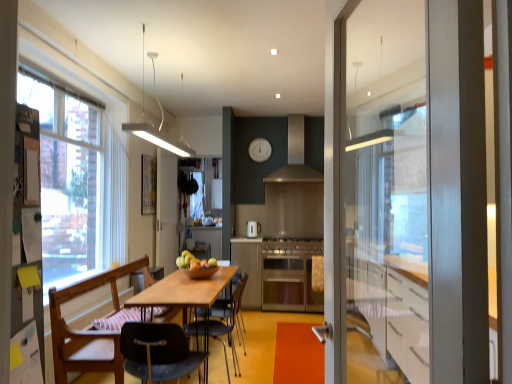
This screenshot has width=512, height=384. What do you see at coordinates (298, 355) in the screenshot?
I see `metallic silver handle at center` at bounding box center [298, 355].

What is the approximate width of yellow matte apple at center?

9.06 inches.

Describe the element at coordinates (260, 150) in the screenshot. I see `white matte clock at upper center` at that location.

Locate an element on the screen. stainless steel oven at center is located at coordinates (253, 229).

The width and height of the screenshot is (512, 384). What do you see at coordinates (296, 156) in the screenshot?
I see `satin silver exhaust hood at center` at bounding box center [296, 156].

In order to face black plastic chair at center, the first chair when ordered from front to back, should I rotate leftwards or rightwards?

A 12.026 degree turn to the left will do.

This screenshot has height=384, width=512. I want to click on metallic gray chair at center, the 3th chair positioned from the front, so click(x=222, y=324).

From a real-world perspective, between wooden chair at left, marked as the 2th chair in a back-to-front arrangement, and metallic gray chair at center, the 3th chair positioned from the front, who is vertically lower?

metallic gray chair at center, the 3th chair positioned from the front.

Considering the sizes of objects wooden chair at left, marked as the 2th chair in a back-to-front arrangement, and metallic gray chair at center, which ranks as the first chair in back-to-front order, in the image provided, who is shorter, wooden chair at left, marked as the 2th chair in a back-to-front arrangement, or metallic gray chair at center, which ranks as the first chair in back-to-front order,?

metallic gray chair at center, which ranks as the first chair in back-to-front order.

From the image's perspective, is wooden chair at left, which appears as the 2th chair when viewed from the front, over metallic gray chair at center, which ranks as the first chair in back-to-front order?

Correct, wooden chair at left, which appears as the 2th chair when viewed from the front, appears higher than metallic gray chair at center, which ranks as the first chair in back-to-front order, in the image.

Is the depth of wooden chair at left, which appears as the 2th chair when viewed from the front, less than that of metallic gray chair at center, which ranks as the first chair in back-to-front order?

Yes, it is in front of metallic gray chair at center, which ranks as the first chair in back-to-front order.

Is stainless steel oven at center at the left side of stainless steel stove at center?

Yes, stainless steel oven at center is to the left of stainless steel stove at center.

Is stainless steel oven at center smaller than stainless steel stove at center?

Indeed, stainless steel oven at center has a smaller size compared to stainless steel stove at center.

Find the location of a particular element. This screenshot has height=384, width=512. stove in front of the stainless steel oven at center is located at coordinates (292, 245).

Is yellow matte apple at center completely or partially outside of satin silver oven at center?

Indeed, yellow matte apple at center is completely outside satin silver oven at center.

Can you confirm if yellow matte apple at center is shorter than satin silver oven at center?

Yes.

Looking at this image, is yellow matte apple at center bigger than satin silver oven at center?

Incorrect, yellow matte apple at center is not larger than satin silver oven at center.

From a real-world perspective, relative to satin silver exhaust hood at center, is wooden chair at left, which appears as the 2th chair when viewed from the front, vertically above or below?

In terms of real-world spatial position, wooden chair at left, which appears as the 2th chair when viewed from the front, is below satin silver exhaust hood at center.

Consider the image. Which is nearer, (58, 305) or (296, 146)?

Point (58, 305) is closer to the camera than point (296, 146).

Is wooden chair at left, which appears as the 2th chair when viewed from the front, situated inside satin silver exhaust hood at center or outside?

wooden chair at left, which appears as the 2th chair when viewed from the front, lies outside satin silver exhaust hood at center.

Considering the sizes of objects wooden chair at left, marked as the 2th chair in a back-to-front arrangement, and satin silver exhaust hood at center in the image provided, who is bigger, wooden chair at left, marked as the 2th chair in a back-to-front arrangement, or satin silver exhaust hood at center?

wooden chair at left, marked as the 2th chair in a back-to-front arrangement, is bigger.

Does stainless steel stove at center turn towards satin silver exhaust hood at center?

No.

Does stainless steel stove at center appear on the right side of satin silver exhaust hood at center?

No.

From a real-world perspective, which is physically below, stainless steel stove at center or satin silver exhaust hood at center?

stainless steel stove at center.

Looking at their sizes, would you say metallic gray chair at center, the 3th chair positioned from the front, is wider or thinner than metallic silver handle at center?

In the image, metallic gray chair at center, the 3th chair positioned from the front, appears to be more narrow than metallic silver handle at center.

How much distance is there between metallic gray chair at center, the 3th chair positioned from the front, and metallic silver handle at center?

The distance of metallic gray chair at center, the 3th chair positioned from the front, from metallic silver handle at center is 21.64 inches.

Can you tell me how much metallic gray chair at center, which ranks as the first chair in back-to-front order, and metallic silver handle at center differ in facing direction?

89.9 degrees separate the facing orientations of metallic gray chair at center, which ranks as the first chair in back-to-front order, and metallic silver handle at center.

From the image's perspective, is metallic gray chair at center, which ranks as the first chair in back-to-front order, above metallic silver handle at center?

Yes, from the image's perspective, metallic gray chair at center, which ranks as the first chair in back-to-front order, is on top of metallic silver handle at center.

Is yellow matte apple at center in contact with black plastic chair at center, the third chair viewed from the back?

yellow matte apple at center and black plastic chair at center, the third chair viewed from the back, are not in contact.

How far apart are yellow matte apple at center and black plastic chair at center, the first chair when ordered from front to back?

3.67 feet.

Is yellow matte apple at center shorter than black plastic chair at center, the first chair when ordered from front to back?

Indeed, yellow matte apple at center has a lesser height compared to black plastic chair at center, the first chair when ordered from front to back.

From a real-world perspective, which object rests below the other?

black plastic chair at center, the first chair when ordered from front to back.

What are the coordinates of `the 2nd chair to the left of the metallic gray chair at center, which ranks as the first chair in back-to-front order, starting your count from the anchor` in the screenshot? It's located at (94, 326).

You are a GUI agent. You are given a task and a screenshot of the screen. Output one action in this format:
    pyautogui.click(x=<x>, y=<y>)
    Task: Click on the stove that is in front of the stainless steel oven at center
    This screenshot has height=384, width=512.
    Given the screenshot: What is the action you would take?
    pyautogui.click(x=292, y=245)

Estimate the real-world distances between objects in this image. Which object is further from stainless steel oven at center, satin silver exhaust hood at center or white matte clock at upper center?

satin silver exhaust hood at center.

Which object lies nearer to the anchor point wooden chair at left, which appears as the 2th chair when viewed from the front, metallic silver handle at center or clear glass window at left?

clear glass window at left.

From the image, which object appears to be nearer to yellow matte apple at center, metallic gray chair at center, which ranks as the first chair in back-to-front order, or satin silver oven at center?

metallic gray chair at center, which ranks as the first chair in back-to-front order.

Based on their spatial positions, is satin silver exhaust hood at center or metallic gray chair at center, which ranks as the first chair in back-to-front order, closer to wooden table at center?

Based on the image, metallic gray chair at center, which ranks as the first chair in back-to-front order, appears to be nearer to wooden table at center.

Which object lies further to the anchor point stainless steel stove at center, metallic silver handle at center or clear glass window at left?

clear glass window at left is positioned further to the anchor stainless steel stove at center.

When comparing their distances from stainless steel oven at center, does black plastic chair at center, the first chair when ordered from front to back, or wooden chair at left, which appears as the 2th chair when viewed from the front, seem further?

The object further to stainless steel oven at center is black plastic chair at center, the first chair when ordered from front to back.

Looking at the image, which one is located closer to wooden table at center, satin silver oven at center or wooden chair at left, marked as the 2th chair in a back-to-front arrangement?

wooden chair at left, marked as the 2th chair in a back-to-front arrangement.

From the image, which object appears to be farther from stainless steel stove at center, satin silver oven at center or clear glass window at left?

The object further to stainless steel stove at center is clear glass window at left.

Image resolution: width=512 pixels, height=384 pixels. Identify the location of apple located between clear glass window at left and stainless steel stove at center in the depth direction. (194, 261).

Find the location of `chair between black plastic chair at center, the first chair when ordered from front to back, and metallic gray chair at center, the 3th chair positioned from the front, from front to back`. chair between black plastic chair at center, the first chair when ordered from front to back, and metallic gray chair at center, the 3th chair positioned from the front, from front to back is located at coordinates coord(94,326).

At what (x,y) coordinates should I click in order to perform the action: click on exhaust hood between black plastic chair at center, the third chair viewed from the back, and white matte clock at upper center in the front-back direction. Please return your answer as a coordinate pair (x, y). Looking at the image, I should click on (296, 156).

Find the location of a particular element. This screenshot has height=384, width=512. plain between wooden chair at left, marked as the 2th chair in a back-to-front arrangement, and stainless steel stove at center, along the z-axis is located at coordinates (298, 355).